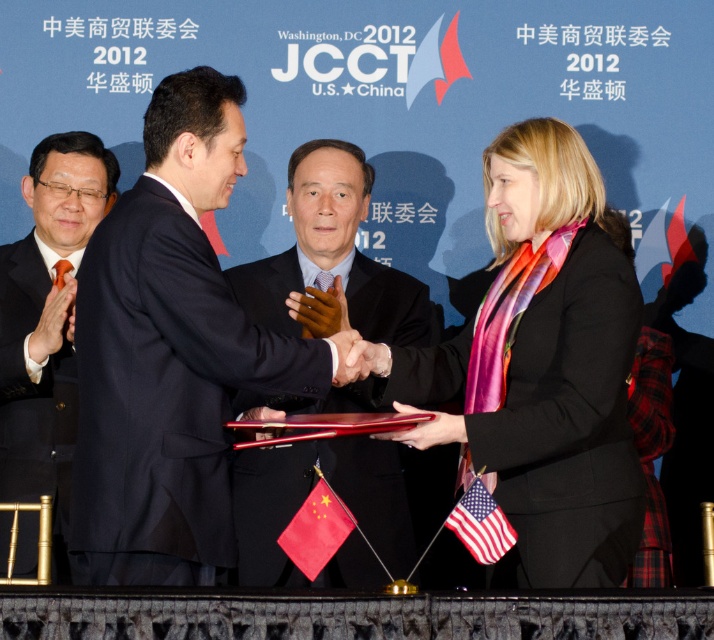
Question: Which point appears farthest from the camera in this image?

Choices:
 (A) click(531, 502)
 (B) click(66, 134)
 (C) click(346, 269)

Answer: (C)

Question: Is black silk scarf at center thinner than black suit at left?

Choices:
 (A) yes
 (B) no

Answer: (B)

Question: Can you confirm if dark blue suit at center is thinner than black suit at left?

Choices:
 (A) no
 (B) yes

Answer: (A)

Question: Which object is positioned closest to the black suit at left?

Choices:
 (A) dark blue suit at center
 (B) black silk scarf at center

Answer: (A)

Question: Which object is farther from the camera taking this photo?

Choices:
 (A) black suit at left
 (B) dark blue suit at center
 (C) black suit at center

Answer: (B)

Question: Is black silk scarf at center closer to the viewer compared to dark blue suit at center?

Choices:
 (A) yes
 (B) no

Answer: (A)